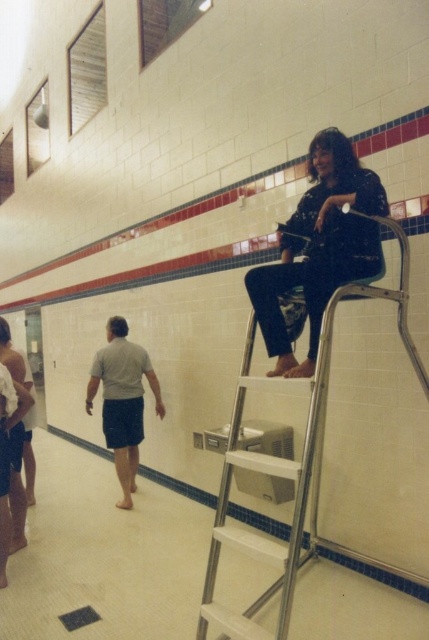
You are a maintenance worker needing to reach the silver metallic ladder at upper center. You are currently standing at the location of the gray cotton shorts at lower left. Can you safely walk to the ladder without needing to move any objects in the scene?

The silver metallic ladder at upper center and gray cotton shorts at lower left are 2.18 meters apart from each other. Since there is no mention of obstacles between them in the scene description, you can safely walk to the ladder without needing to move any objects.

You are designing a safety plan for the indoor pool area and need to ensure there is enough space between the silver metallic ladder at upper center and the matte black shirt at upper right for emergency access. Based on their widths, can you determine if there is sufficient space between them?

The silver metallic ladder at upper center might be wider than matte black shirt at upper right, so there may not be enough space between them for emergency access. Further measurements are needed to confirm.

You are standing at the poolside and want to locate the matte black shirt at upper right and the gray cotton shorts at lower left. Which object is positioned to the right side of the other?

The matte black shirt at upper right is positioned to the right of the gray cotton shorts at lower left.